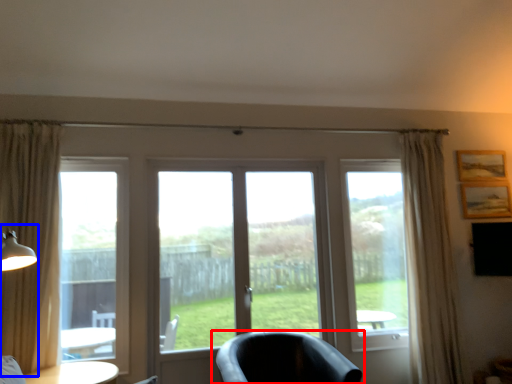
Question: Which of the following is the closest to the observer, chair (highlighted by a red box) or table lamp (highlighted by a blue box)?

Choices:
 (A) chair
 (B) table lamp

Answer: (B)